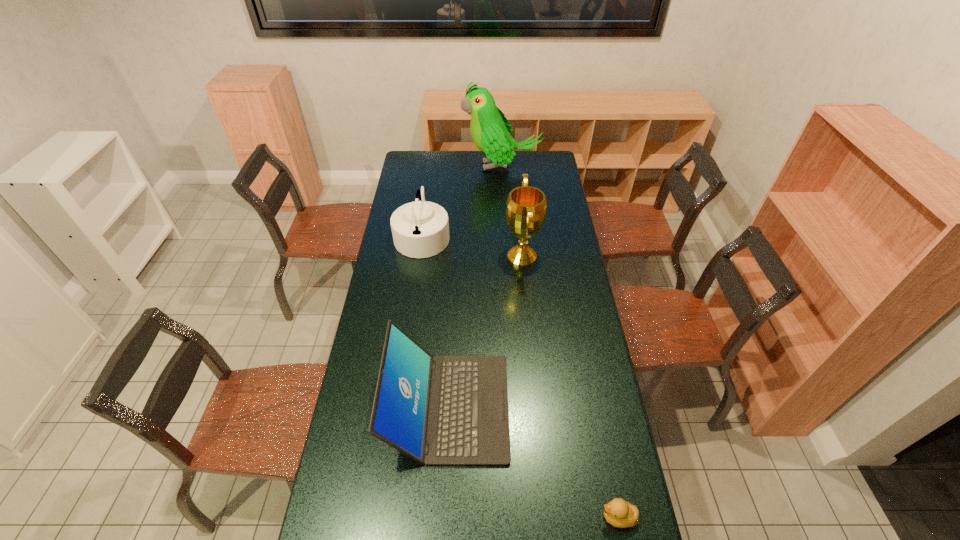
Image resolution: width=960 pixels, height=540 pixels. Identify the location of the farthest object. (490, 130).

The image size is (960, 540). I want to click on parakeet, so 490,130.

Locate an element on the screen. award is located at coordinates (526, 206).

Identify the location of kettle. [420, 229].

Where is `the second nearest object`? Image resolution: width=960 pixels, height=540 pixels. the second nearest object is located at coordinates (448, 409).

At what (x,y) coordinates should I click in order to perform the action: click on the nearest object. Please return your answer as a coordinate pair (x, y). This screenshot has width=960, height=540. Looking at the image, I should click on (620, 513).

This screenshot has height=540, width=960. I want to click on the shortest object, so click(x=620, y=513).

Image resolution: width=960 pixels, height=540 pixels. Find the location of `vacant point located 0.170m on the beak of the parakeet`. vacant point located 0.170m on the beak of the parakeet is located at coordinates (434, 166).

This screenshot has width=960, height=540. Find the location of `blank space located on the beak of the parakeet`. blank space located on the beak of the parakeet is located at coordinates [x=404, y=166].

The width and height of the screenshot is (960, 540). Identify the location of vacant space located 0.200m on the beak of the parakeet. (428, 166).